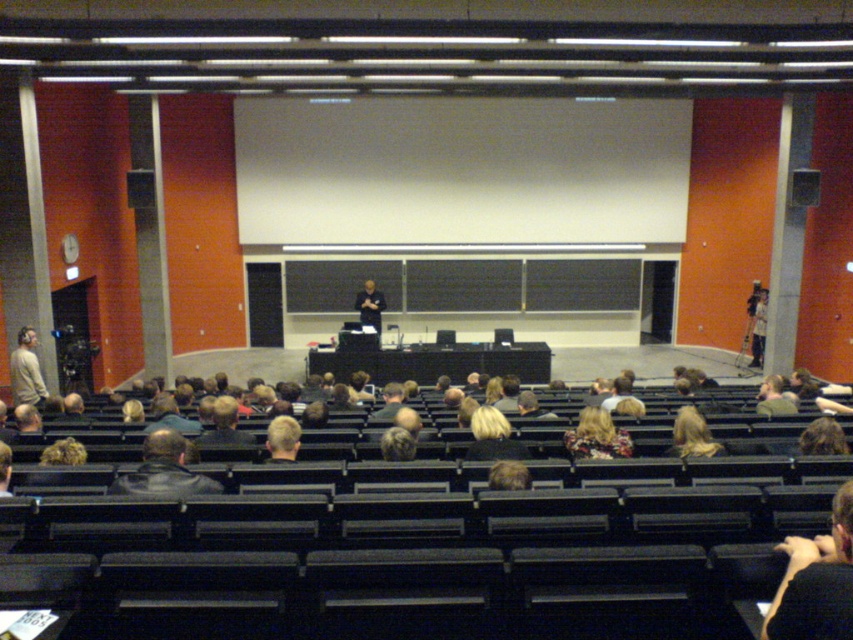
Who is positioned more to the right, dark brown leather jacket at lower right or leather jacket at lower left?

Positioned to the right is dark brown leather jacket at lower right.

In the scene shown: Who is more forward, (782, 604) or (138, 488)?

Point (782, 604) is in front.

Find the location of a particular element. The height and width of the screenshot is (640, 853). dark brown leather jacket at lower right is located at coordinates (816, 580).